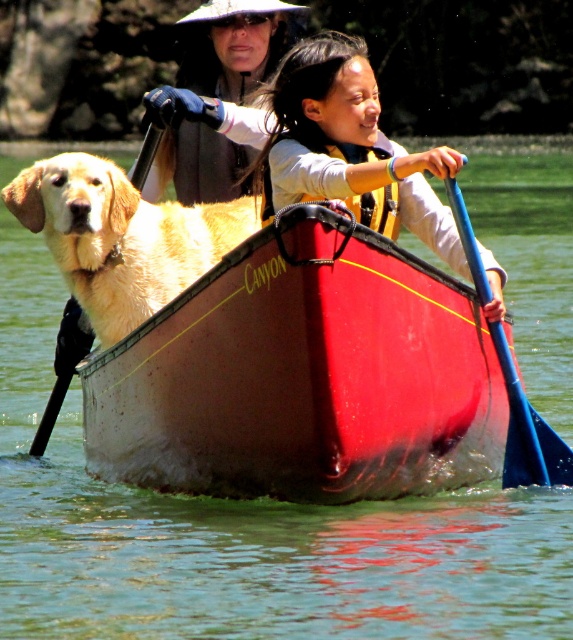
You are a photographer trying to capture the scene from the camera position. The matte black jacket at upper center and the black rubber paddle at left are both in your view. Which object will appear larger in your photo?

The matte black jacket at upper center will appear larger in the photo because it is taller than the black rubber paddle at left.

You are a safety inspector checking the canoe for proper equipment. The safety regulations require that all passengers must be within 3 meters of the canoe to reach a life jacket in case of emergency. Are both the shiny red canoe at center and the golden fur dog at left compliant with this regulation?

The shiny red canoe at center and the golden fur dog at left are 3.13 meters apart from each other, which exceeds the 3 meter requirement. Therefore, they are not compliant with the regulation.